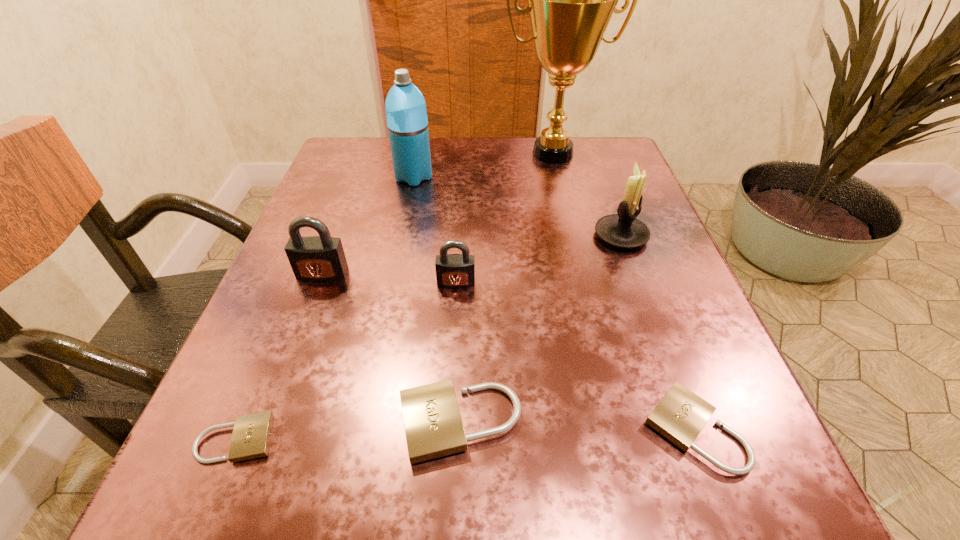
Where is `the third shortest padlock`? the third shortest padlock is located at coordinates (433, 425).

The image size is (960, 540). Find the location of `the sixth tallest object`. the sixth tallest object is located at coordinates (433, 425).

Identify the location of the rightmost padlock. This screenshot has height=540, width=960. (680, 415).

Image resolution: width=960 pixels, height=540 pixels. Find the location of `the rightmost beige padlock`. the rightmost beige padlock is located at coordinates coord(680,415).

Identify the location of the shortest padlock. This screenshot has width=960, height=540. (251, 436).

Where is `the shortest object`? the shortest object is located at coordinates (251, 436).

This screenshot has width=960, height=540. What are the coordinates of `free space located 0.090m on the front view with handles of the tallest object` in the screenshot? It's located at (563, 195).

You are a GUI agent. You are given a task and a screenshot of the screen. Output one action in this format:
    pyautogui.click(x=<x>, y=<y>)
    Task: Click on the free region located on the left of the sixth object from right to left
    This screenshot has width=960, height=540.
    Given the screenshot: What is the action you would take?
    pyautogui.click(x=360, y=177)

The height and width of the screenshot is (540, 960). Find the location of `free space located 0.170m on the back of the sixth nearest object`. free space located 0.170m on the back of the sixth nearest object is located at coordinates (599, 174).

Find the location of `vacant space located on the front of the fifth shortest object near the keyhole`. vacant space located on the front of the fifth shortest object near the keyhole is located at coordinates (276, 399).